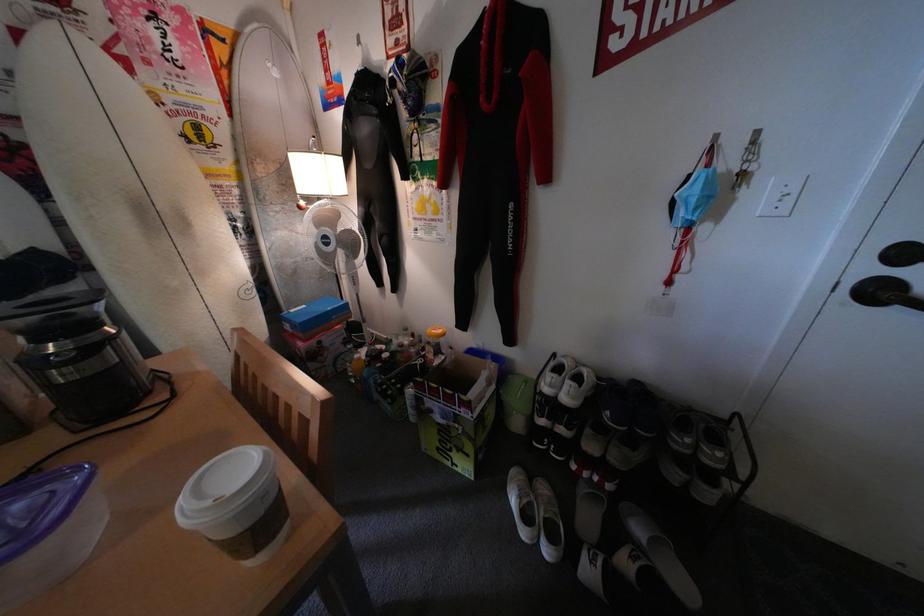
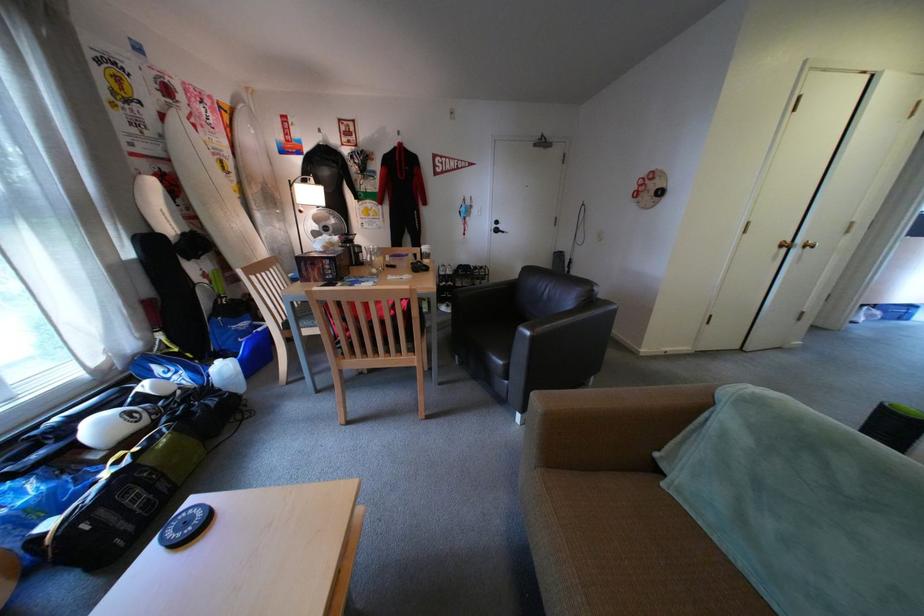
In the second image, find the point that corresponds to the point at 90,379 in the first image.

(373, 253)